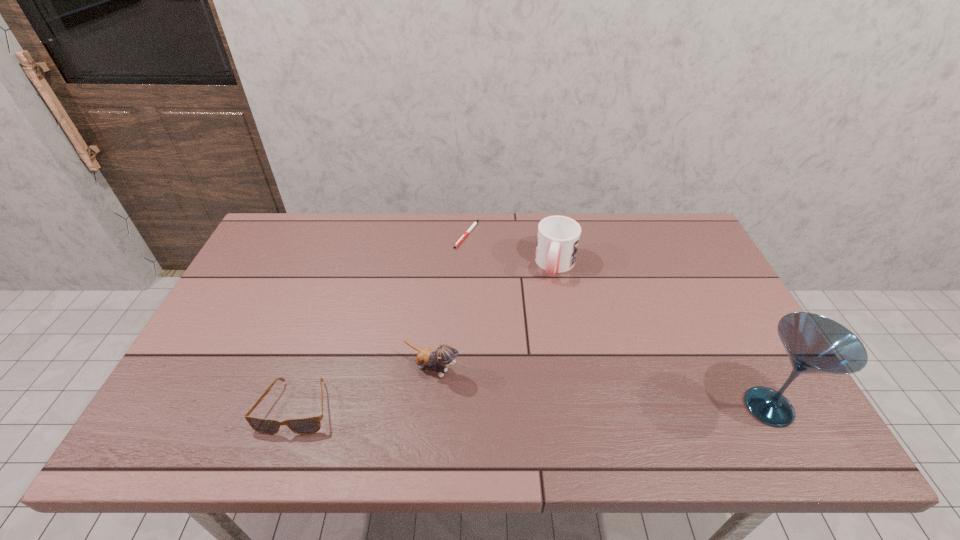
Image resolution: width=960 pixels, height=540 pixels. I want to click on vacant space on the desktop that is between the fourth tallest object and the tallest object and is positioned on the side of the fourth object from left to right with the handle, so click(x=517, y=407).

Find the location of a particular element. This screenshot has width=960, height=540. vacant space on the desktop that is between the sunglasses and the rightmost object and is positioned on the clicker of the shortest object is located at coordinates (484, 407).

This screenshot has height=540, width=960. In order to click on vacant space on the desktop that is between the second shortest object and the martini and is positioned on the front-facing side of the third shortest object in this screenshot , I will do `click(505, 407)`.